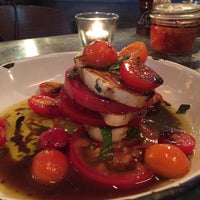
At what (x,y) coordinates should I click in order to perform the action: click on brown chair. Please return your answer as a coordinate pair (x, y). Looking at the image, I should click on (28, 21).